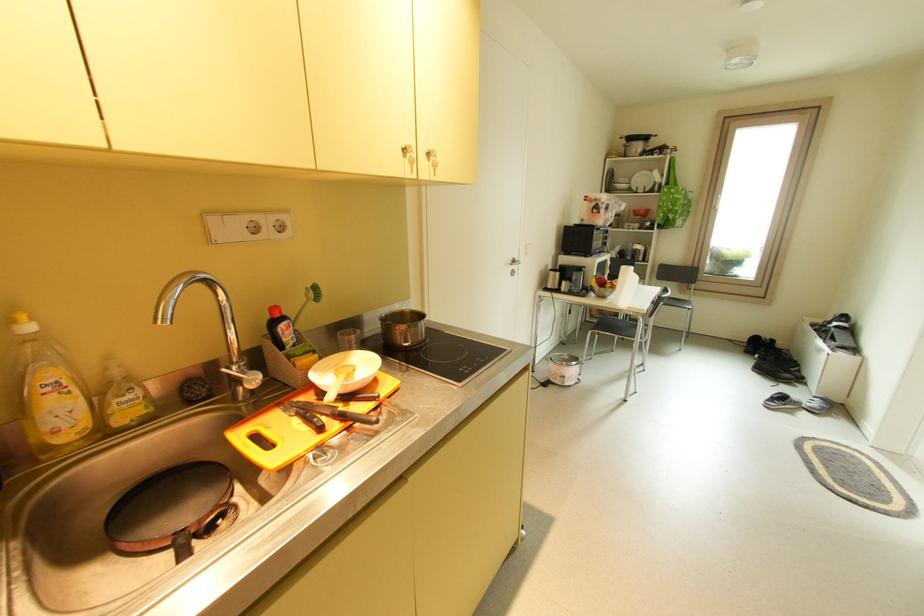
Where would you lift the sink faucet handle? Please return your answer as a coordinate pair (x, y).

(245, 377)